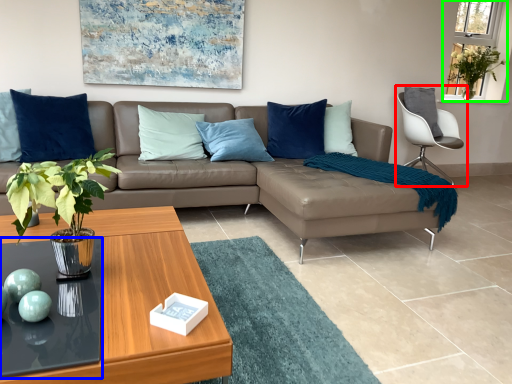
Question: Which object is positioned closest to chair (highlighted by a red box)? Select from glass table (highlighted by a blue box) and window screen (highlighted by a green box).

Choices:
 (A) glass table
 (B) window screen

Answer: (B)